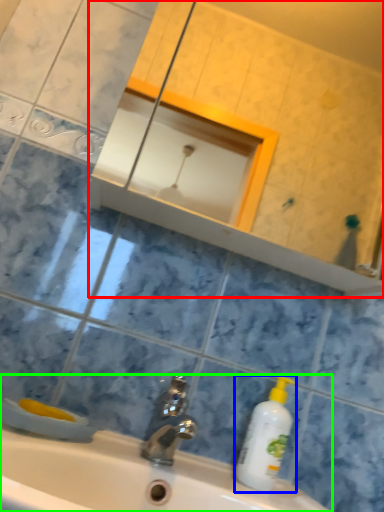
Question: Which is farther away from mirror (highlighted by a red box)? cleaning product (highlighted by a blue box) or sink (highlighted by a green box)?

Choices:
 (A) cleaning product
 (B) sink

Answer: (A)